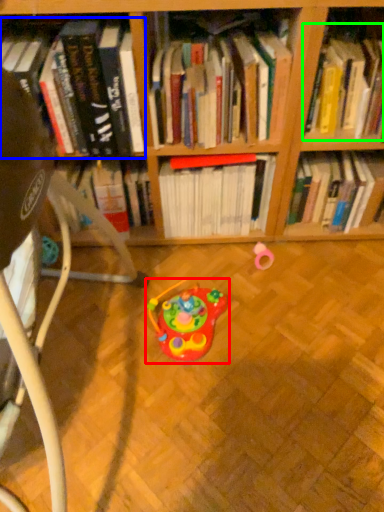
Question: Which object is the closest to the toy (highlighted by a red box)? Choose among these: book (highlighted by a blue box) or book (highlighted by a green box).

Choices:
 (A) book
 (B) book

Answer: (A)